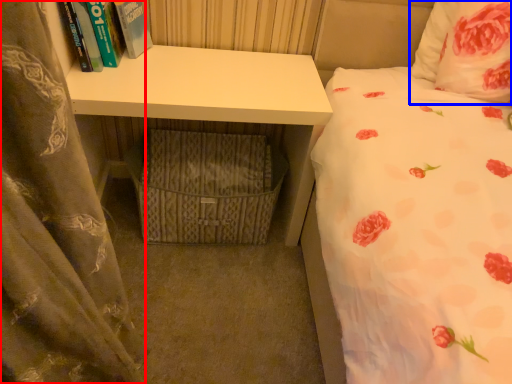
Question: Which object appears farthest to the camera in this image, curtain (highlighted by a red box) or pillow (highlighted by a blue box)?

Choices:
 (A) curtain
 (B) pillow

Answer: (B)